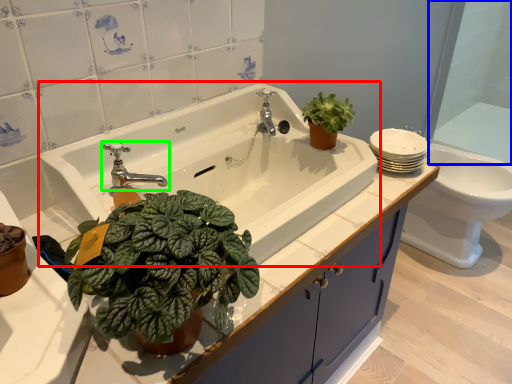
Question: Based on their relative distances, which object is farther from sink (highlighted by a red box)? Choose from glass door (highlighted by a blue box) and tap (highlighted by a green box).

Choices:
 (A) glass door
 (B) tap

Answer: (A)